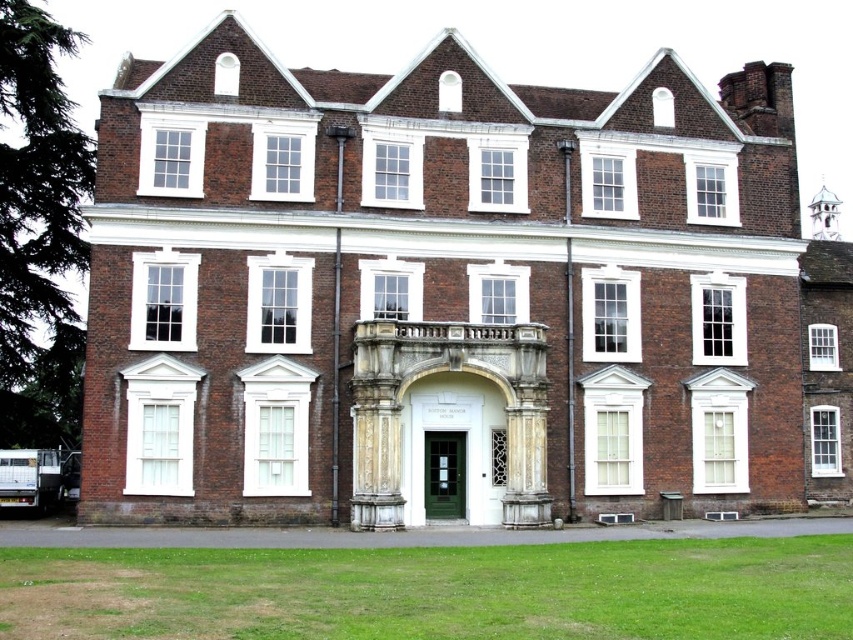
Question: Is brown brick mansion at center positioned at the back of green grass at lower center?

Choices:
 (A) yes
 (B) no

Answer: (A)

Question: Which point appears farthest from the camera in this image?

Choices:
 (A) (264, 305)
 (B) (733, 620)

Answer: (A)

Question: Is brown brick mansion at center smaller than green grass at lower center?

Choices:
 (A) no
 (B) yes

Answer: (A)

Question: Does brown brick mansion at center lie in front of green grass at lower center?

Choices:
 (A) no
 (B) yes

Answer: (A)

Question: Which point appears farthest from the camera in this image?

Choices:
 (A) (125, 564)
 (B) (532, 404)

Answer: (B)